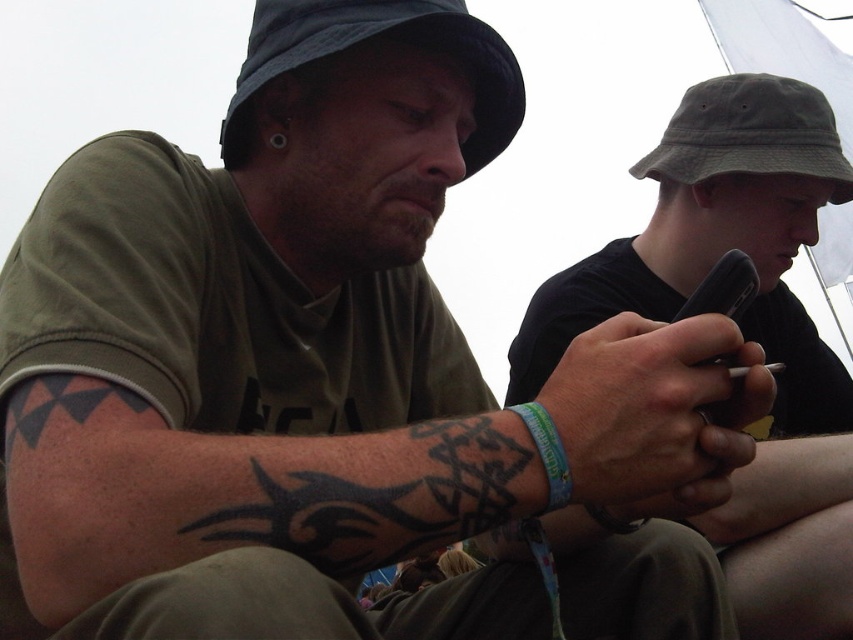
Consider the image. You are a photographer trying to capture a closeup of the matte black phone at center. Based on its coordinates, where should you position your camera to ensure the phone is centered in the frame?

The matte black phone at center is located at coordinates point [741,332], so positioning the camera to aim directly at those coordinates will center the phone in the frame.

You are a photographer taking a picture of the two people under the tent. You notice two points marked at coordinates point (x=535, y=369) and point (x=532, y=428). Which point is closer to your camera?

Point (x=532, y=428) is closer to the camera because it is less further than point (x=535, y=369).

You are trying to compare the height of the matte black phone at center and the black ink tribal tattoo at lower left. Which one is taller?

The matte black phone at center is much taller than the black ink tribal tattoo at lower left.